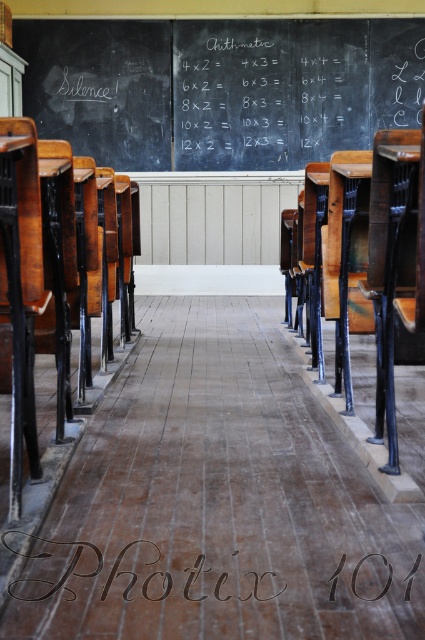
You are a student in this classroom and need to write on the black chalkboard at upper center. Based on its position, where should you stand to reach it comfortably?

Since the black chalkboard at upper center is positioned at coordinates approximately 0.138 on the horizontal axis and 0.518 on the vertical axis, you should stand near the front of the classroom to comfortably reach it.

You are a student in this classroom and need to write a message. Which object would you use to write on, the black chalkboard at upper center or the black textured wood at center?

The black chalkboard at upper center is bigger than the black textured wood at center, so you can write on the black chalkboard at upper center.